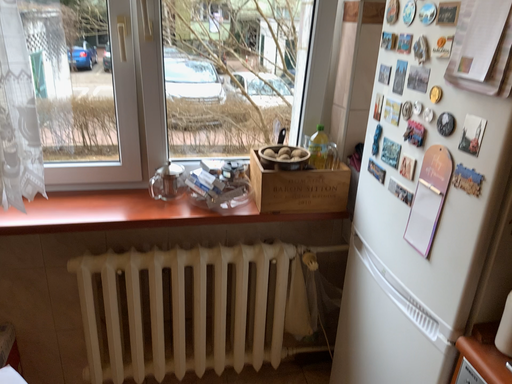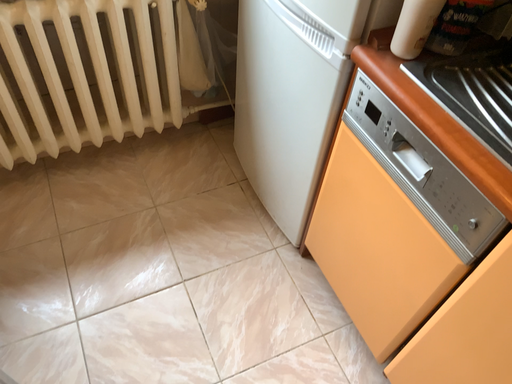
Question: Which way did the camera rotate in the video?

Choices:
 (A) rotated upward
 (B) rotated downward

Answer: (B)